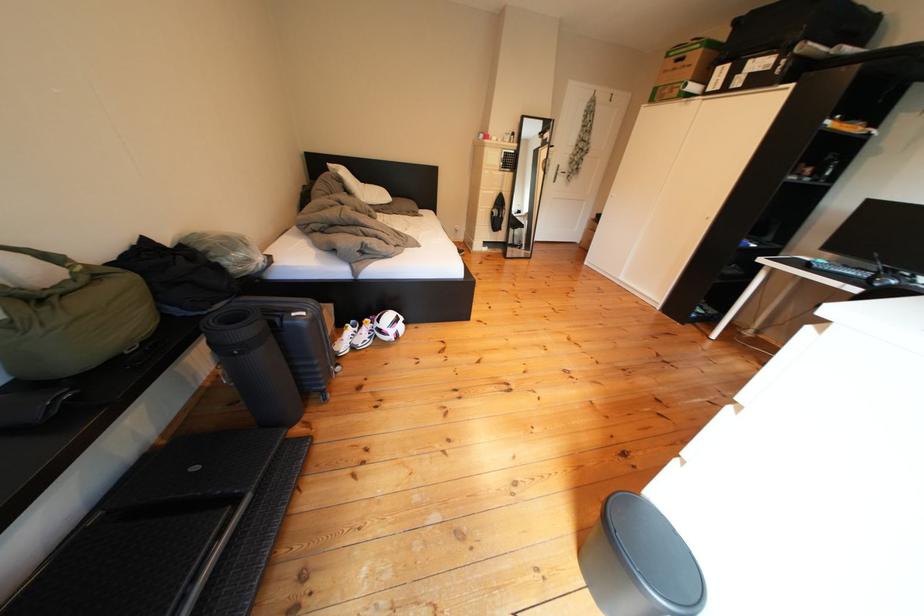
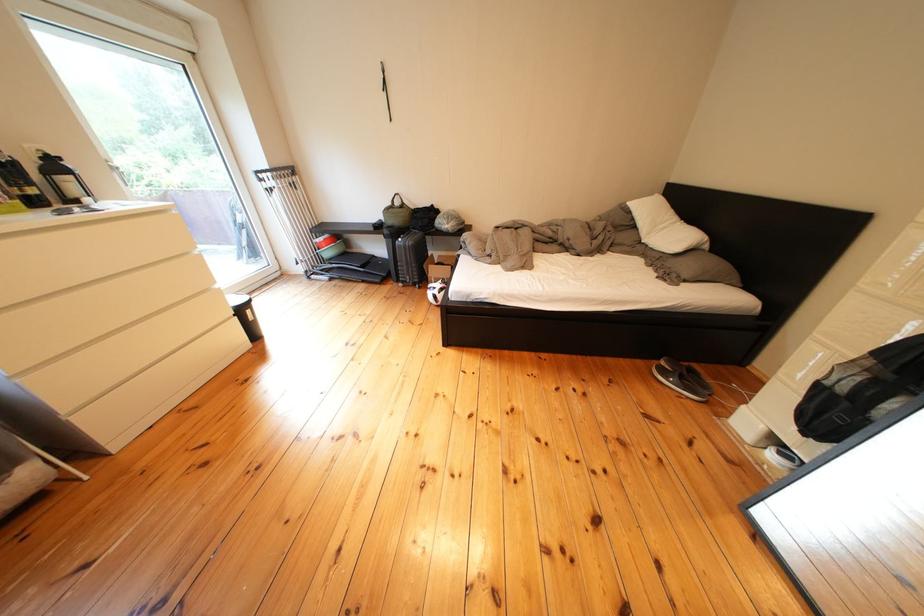
Question: I am providing you with two images of the same scene from different viewpoints. After the viewpoint changes to image2, which objects are now occluded?

Choices:
 (A) bedside drawer handle
 (B) small black trashcan
 (C) white sneaker
 (D) green bag handle

Answer: (C)